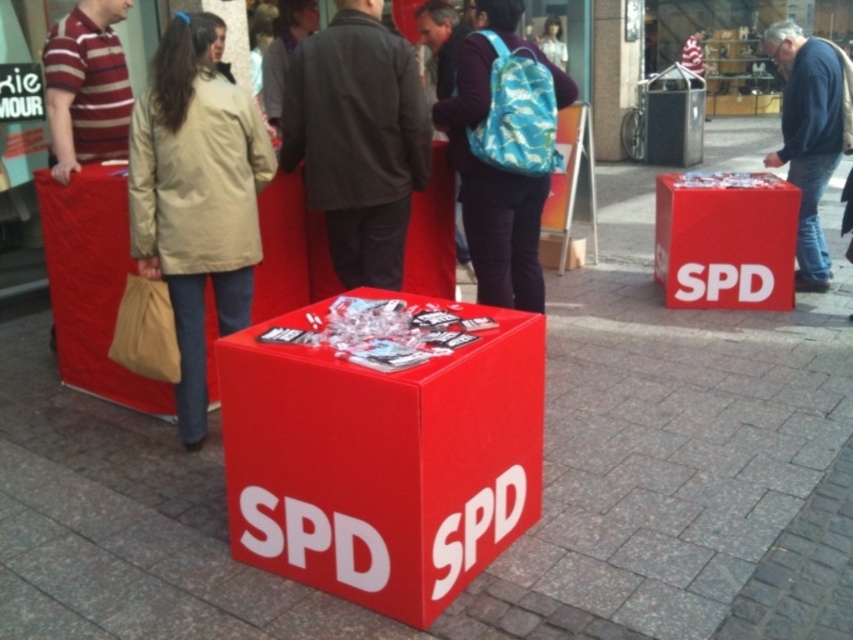
Consider the image. You are a photographer at the SPD event and want to take a photo of the beige fabric coat at center and the matte blue backpack at center. Which object should you focus on first to ensure both are in the frame without moving the camera?

The beige fabric coat at center is positioned under the matte blue backpack at center, so you should focus on the matte blue backpack at center first to ensure both are in the frame without moving the camera.

You are a photographer trying to capture the red matte cube at center in your shot. There is a point marked at coordinates [724,240] in the image. Is this point located on the red matte cube at center?

Yes, the point at coordinates [724,240] is on the red matte cube at center, so it is located on the cube.